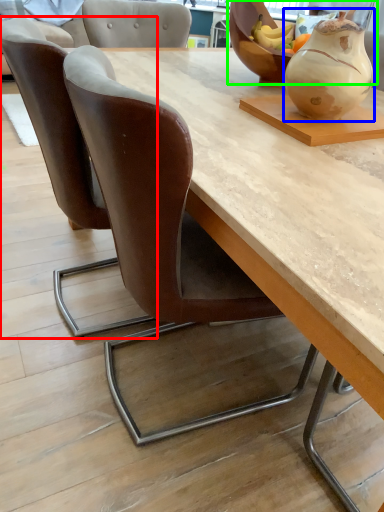
Question: Considering the real-world distances, which object is closest to chair (highlighted by a red box)? vase (highlighted by a blue box) or bowl (highlighted by a green box).

Choices:
 (A) vase
 (B) bowl

Answer: (A)